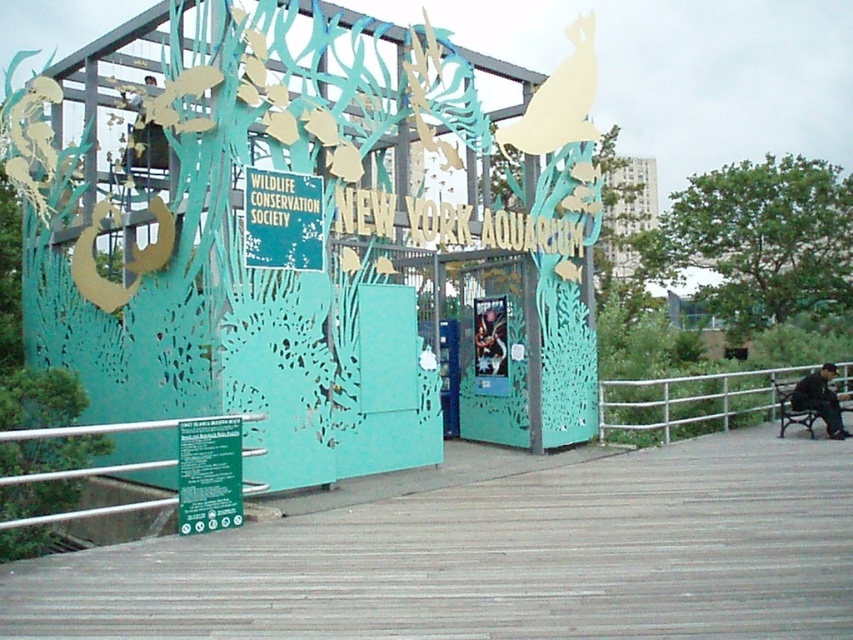
Can you confirm if wooden planks at lower center is taller than white metal railing at lower right?

No, wooden planks at lower center is not taller than white metal railing at lower right.

What do you see at coordinates (496, 557) in the screenshot? I see `wooden planks at lower center` at bounding box center [496, 557].

Locate an element on the screen. This screenshot has height=640, width=853. wooden planks at lower center is located at coordinates (496, 557).